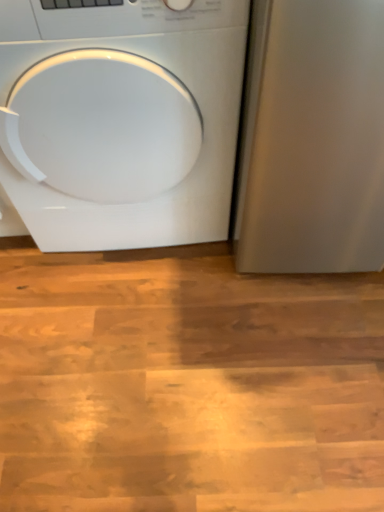
At what (x,y) coordinates should I click in order to perform the action: click on space that is in front of white glossy washing machine at left. Please return your answer as a coordinate pair (x, y). Image resolution: width=384 pixels, height=512 pixels. Looking at the image, I should click on (145, 334).